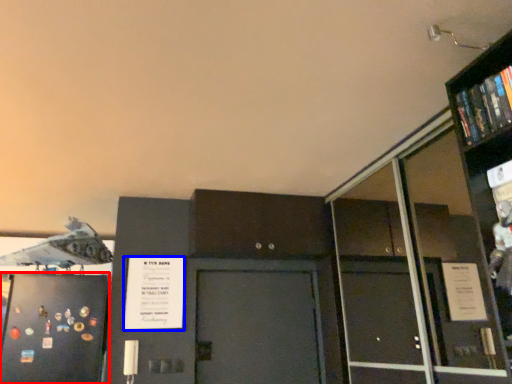
Question: Which object is further to the camera taking this photo, door (highlighted by a red box) or poster (highlighted by a blue box)?

Choices:
 (A) door
 (B) poster

Answer: (B)